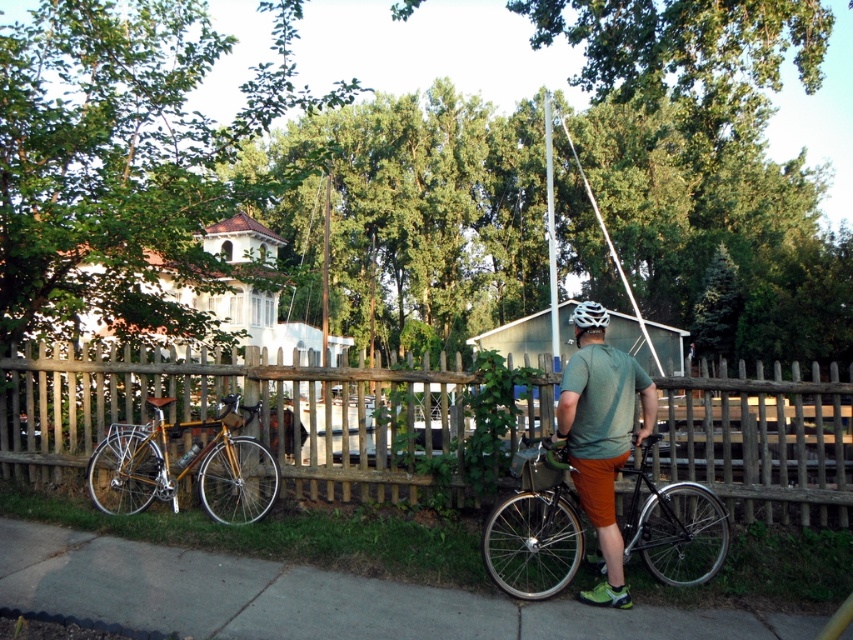
Question: Can you confirm if wooden picket fence at center is thinner than white glossy bicycle helmet at upper center?

Choices:
 (A) yes
 (B) no

Answer: (B)

Question: Which of these objects is positioned closest to the gold bamboo bicycle at lower left?

Choices:
 (A) green matte shirt at center
 (B) gray concrete pavement at lower center
 (C) shiny silver bicycle at center
 (D) white glossy bicycle helmet at upper center

Answer: (B)

Question: Which point is farther from the camera taking this photo?

Choices:
 (A) (577, 307)
 (B) (590, 385)
 (C) (506, 552)
 (D) (541, 604)

Answer: (A)

Question: Which of the following is the closest to the observer?

Choices:
 (A) gold bamboo bicycle at lower left
 (B) green matte shirt at center
 (C) shiny silver bicycle at center
 (D) gray concrete pavement at lower center

Answer: (D)

Question: Does wooden picket fence at center have a larger size compared to shiny silver bicycle at center?

Choices:
 (A) no
 (B) yes

Answer: (B)

Question: Is shiny silver bicycle at center smaller than gold bamboo bicycle at lower left?

Choices:
 (A) no
 (B) yes

Answer: (B)